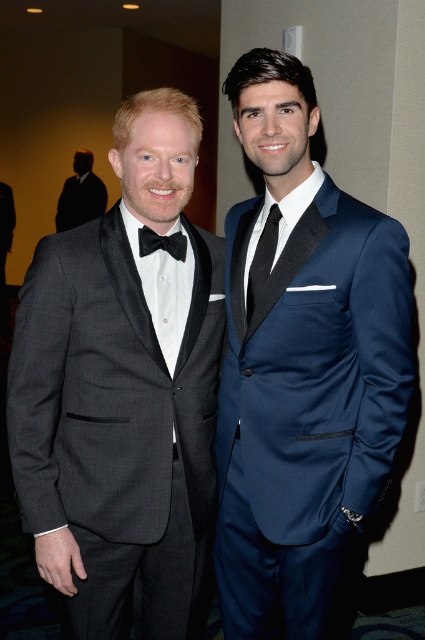
In the scene shown: You are a photographer setting up for a formal event. You need to position a spotlight to the left of the navy satin suit at center and another to the right of the black satin tie at center. Will the spotlights overlap each other?

The navy satin suit at center is to the right of the black satin tie at center. Placing a spotlight to the left of the navy satin suit at center and another to the right of the black satin tie at center would mean the spotlights are positioned on opposite sides of the two objects. Since the navy satin suit is already to the right of the black satin tie, the spotlight to the left of the navy suit would be further right than the spotlight to the right of the black tie. Therefore, the spotlights will not overl

You are a photographer setting up for a group photo. You notice the navy satin suit at center and the dark suit at left. Which one is closer to the camera?

The navy satin suit at center is closer to the camera than the dark suit at left because it is positioned in front of it.